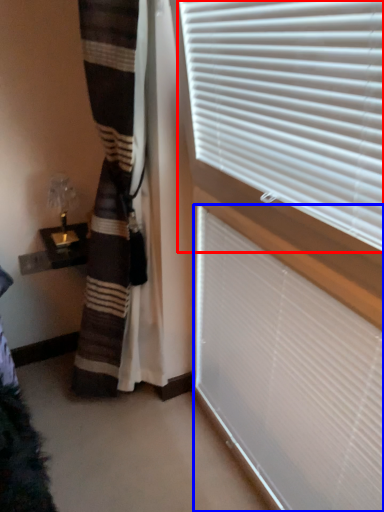
Question: Among these objects, which one is farthest to the camera, window blind (highlighted by a red box) or window blind (highlighted by a blue box)?

Choices:
 (A) window blind
 (B) window blind

Answer: (B)